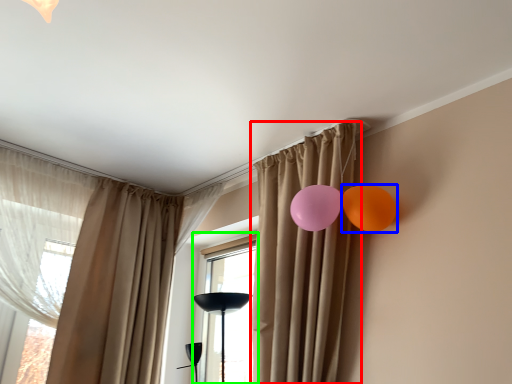
Question: Considering the real-world distances, which object is closest to curtain (highlighted by a red box)? balloon (highlighted by a blue box) or window (highlighted by a green box).

Choices:
 (A) balloon
 (B) window

Answer: (A)